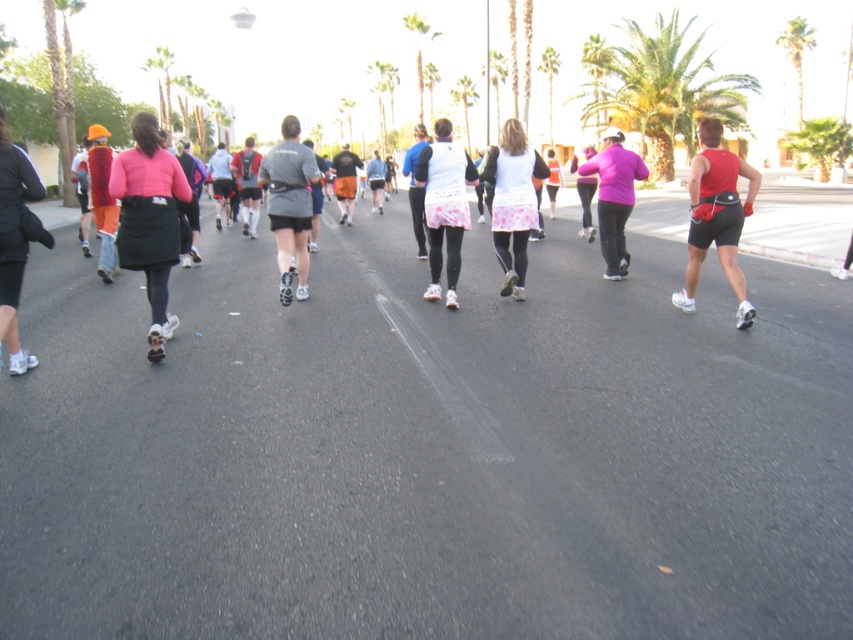
Looking at this image, between green leafy palm tree at upper right and pink matte skirt at center, which one is positioned higher?

green leafy palm tree at upper right

Is green leafy palm tree at upper right positioned in front of pink matte skirt at center?

That is False.

The image size is (853, 640). What do you see at coordinates (665, 88) in the screenshot?
I see `green leafy palm tree at upper right` at bounding box center [665, 88].

The width and height of the screenshot is (853, 640). I want to click on green leafy palm tree at upper right, so click(x=665, y=88).

Between gray matte shorts at center and white matte tank top at center, which one appears on the right side from the viewer's perspective?

white matte tank top at center is more to the right.

Looking at this image, who is taller, gray matte shorts at center or white matte tank top at center?

gray matte shorts at center is taller.

Between point (297, 266) and point (450, 262), which one is positioned in front?

Point (450, 262) is in front.

The image size is (853, 640). Identify the location of gray matte shorts at center. (289, 205).

Can you confirm if pink matte skirt at center is positioned to the right of pink matte jacket at center?

In fact, pink matte skirt at center is to the left of pink matte jacket at center.

Does point (152, 244) lie behind point (616, 202)?

No, (152, 244) is closer to viewer.

This screenshot has width=853, height=640. What are the coordinates of `pink matte skirt at center` in the screenshot? It's located at (148, 212).